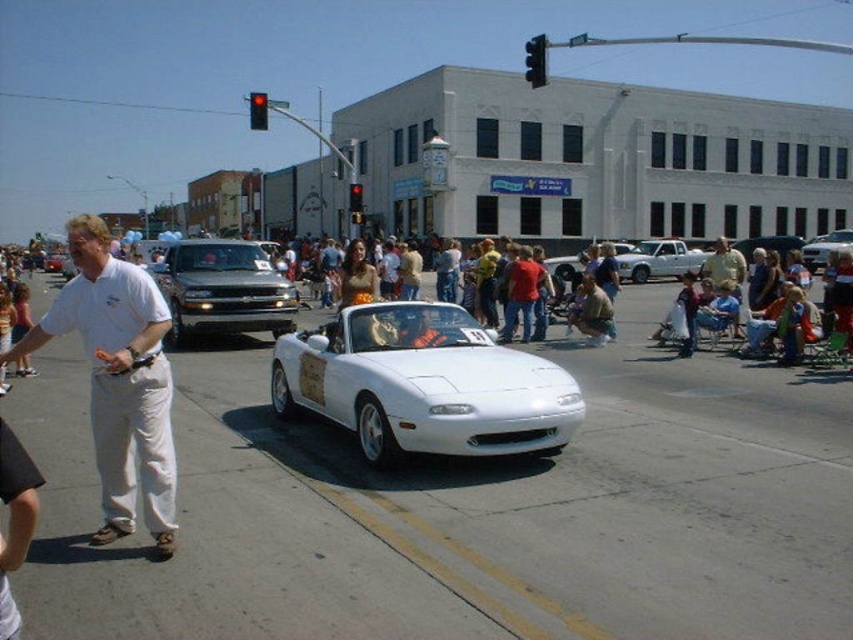
Who is more forward, (364, 304) or (637, 266)?

Point (364, 304) is in front.

Can you confirm if white glossy sports car at center is positioned above white glossy convertible at center?

No.

The width and height of the screenshot is (853, 640). What do you see at coordinates (424, 384) in the screenshot?
I see `white glossy sports car at center` at bounding box center [424, 384].

This screenshot has height=640, width=853. What are the coordinates of `white glossy sports car at center` in the screenshot? It's located at (424, 384).

Can you confirm if white matte convertible at center is positioned to the left of black plastic traffic light at upper center?

Incorrect, white matte convertible at center is not on the left side of black plastic traffic light at upper center.

Between point (805, 253) and point (544, 60), which one is positioned behind?

The point (805, 253) is behind.

Between point (848, 243) and point (537, 72), which one is positioned in front?

Point (537, 72) is more forward.

Locate an element on the screen. The width and height of the screenshot is (853, 640). white matte convertible at center is located at coordinates click(x=825, y=248).

Is white glossy sports car at center to the right of red plastic traffic light at upper center from the viewer's perspective?

Yes, white glossy sports car at center is to the right of red plastic traffic light at upper center.

Between white glossy sports car at center and red plastic traffic light at upper center, which one is positioned lower?

white glossy sports car at center is lower down.

Where is `white glossy sports car at center`? The height and width of the screenshot is (640, 853). white glossy sports car at center is located at coordinates (424, 384).